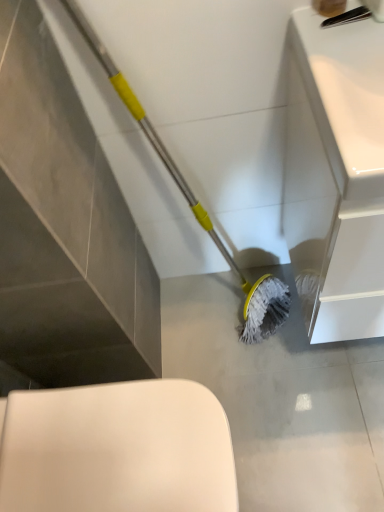
Question: Considering the positions of point (170, 400) and point (307, 265), is point (170, 400) closer or farther from the camera than point (307, 265)?

Choices:
 (A) closer
 (B) farther

Answer: (A)

Question: Is white glossy toilet at lower left in front of or behind white glossy sink at upper right in the image?

Choices:
 (A) front
 (B) behind

Answer: (B)

Question: Which object is the farthest from the white glossy sink at upper right?

Choices:
 (A) white glossy toilet at lower left
 (B) gray matte mop head at lower center

Answer: (A)

Question: Estimate the real-world distances between objects in this image. Which object is farther from the white glossy sink at upper right?

Choices:
 (A) white glossy toilet at lower left
 (B) gray matte mop head at lower center

Answer: (A)